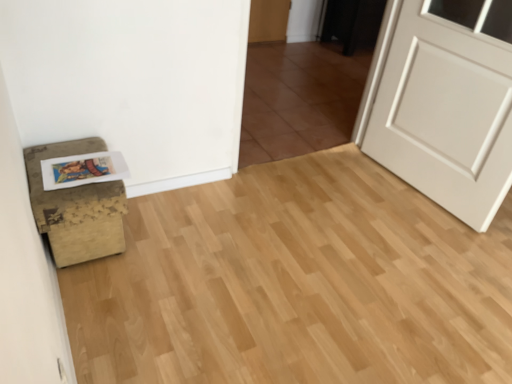
I want to click on free space that is in between white matte door at right and distressed brown ottoman at lower left, so click(x=278, y=213).